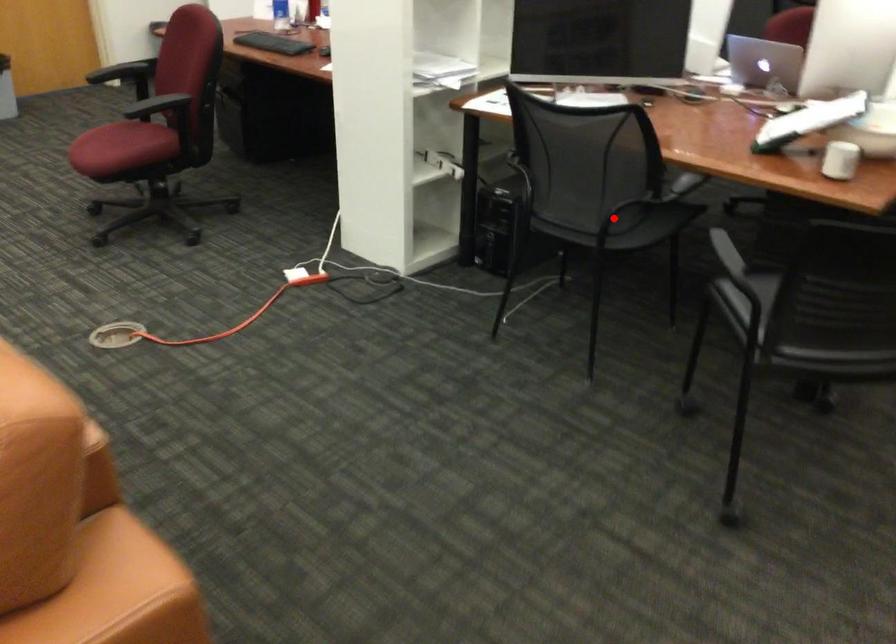
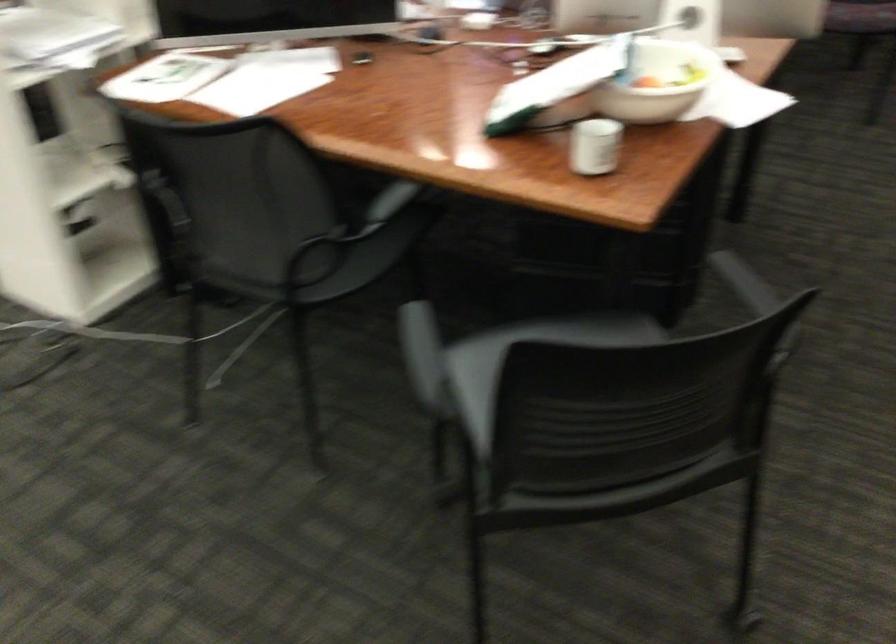
Question: A red point is marked in image1. In image2, is the corresponding 3D point closer to the camera or farther? Reply with the corresponding letter.

Choices:
 (A) The corresponding 3D point is closer.
 (B) The corresponding 3D point is farther.

Answer: (A)